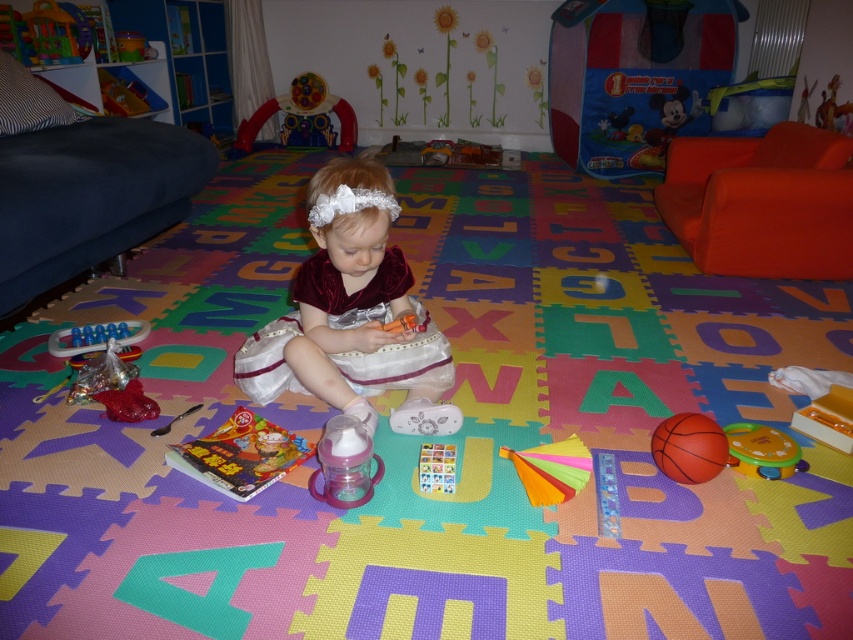
Question: Does orange fabric couch at right lie behind bright orange paper fan at center?

Choices:
 (A) yes
 (B) no

Answer: (A)

Question: Does velvet couch at left have a smaller size compared to plastic colorful cards at center?

Choices:
 (A) no
 (B) yes

Answer: (A)

Question: Which object is the closest to the plastic colorful cards at center?

Choices:
 (A) rubberized plastic toy at lower left
 (B) orange fabric couch at right

Answer: (A)

Question: Is bright orange paper fan at center smaller than yellow rubber drum at lower right?

Choices:
 (A) yes
 (B) no

Answer: (B)

Question: Which of the following is the closest to the observer?

Choices:
 (A) (579, 480)
 (B) (59, 349)

Answer: (A)

Question: Estimate the real-world distances between objects in this image. Which object is closer to the plastic colorful cards at center?

Choices:
 (A) rubber basketball at center
 (B) orange fabric couch at right
 (C) wooden toy at center

Answer: (A)